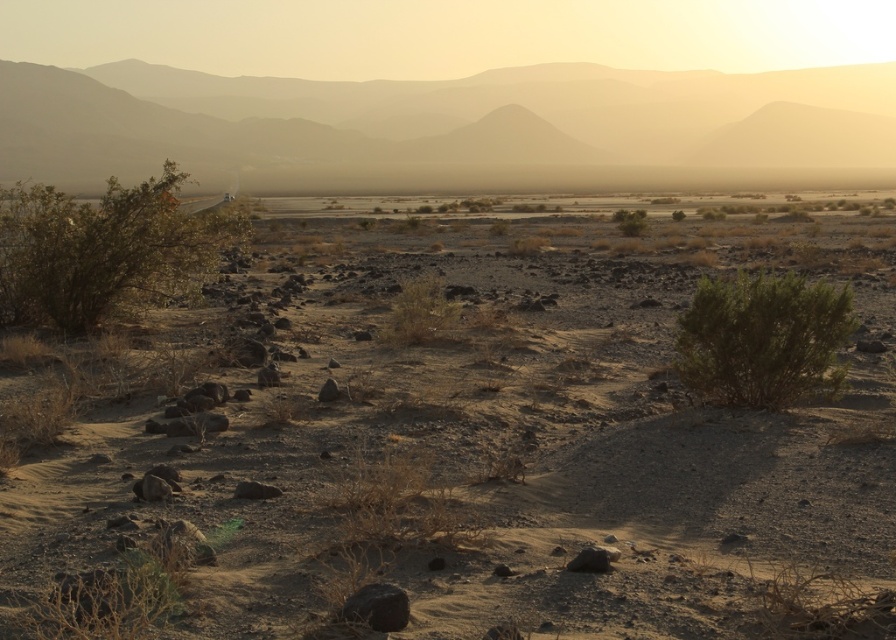
Is sandy brown mountain at upper center smaller than green leafy bush at center?

Actually, sandy brown mountain at upper center might be larger than green leafy bush at center.

Who is lower down, sandy brown mountain at upper center or green leafy bush at center?

green leafy bush at center

Does point (253, 156) come in front of point (626, 211)?

No, (253, 156) is further to viewer.

Locate an element on the screen. The height and width of the screenshot is (640, 896). sandy brown mountain at upper center is located at coordinates (451, 128).

Is green shrub at left behind green leafy bush at center right?

Yes.

Does green shrub at left appear on the right side of green leafy bush at center right?

No, green shrub at left is not to the right of green leafy bush at center right.

Identify the location of green shrub at left. (102, 250).

What do you see at coordinates (451, 128) in the screenshot? I see `sandy brown mountain at upper center` at bounding box center [451, 128].

Who is higher up, sandy brown mountain at upper center or green leafy bush at center right?

sandy brown mountain at upper center is above.

Measure the distance between point (227, 172) and camera.

Point (227, 172) is 111.72 meters away from camera.

At what (x,y) coordinates should I click in order to perform the action: click on sandy brown mountain at upper center. Please return your answer as a coordinate pair (x, y). This screenshot has height=640, width=896. Looking at the image, I should click on (451, 128).